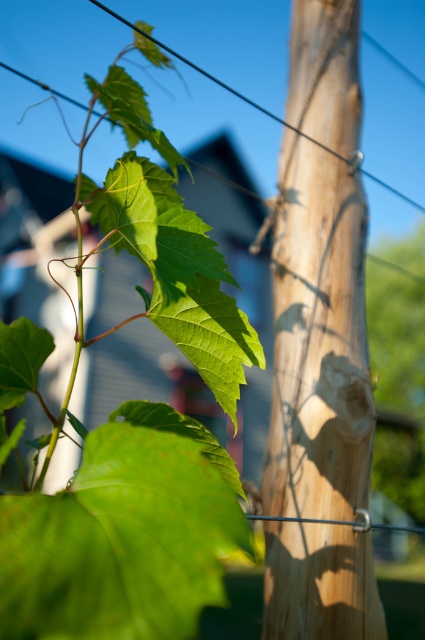
Question: Is wooden telegraph pole at center closer to camera compared to green matte leaf at center-left?

Choices:
 (A) yes
 (B) no

Answer: (B)

Question: Which point appears farthest from the camera in this image?

Choices:
 (A) (167, 330)
 (B) (337, 182)
 (C) (0, 337)
 (D) (99, 564)

Answer: (B)

Question: Which of the following is the farthest from the observer?

Choices:
 (A) (328, 593)
 (B) (121, 99)
 (C) (130, 484)
 (D) (192, 609)

Answer: (A)

Question: Does green matte leaf at upper left appear under green matte leaf at center?

Choices:
 (A) no
 (B) yes

Answer: (A)

Question: Is wooden telegraph pole at center in front of green matte leaf at center?

Choices:
 (A) yes
 (B) no

Answer: (B)

Question: Which of the following is the farthest from the observer?

Choices:
 (A) (136, 81)
 (B) (167, 460)
 (C) (283, 381)
 (D) (397, 321)

Answer: (D)